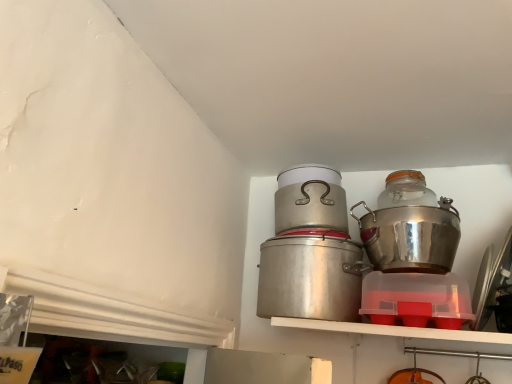
Question: From a real-world perspective, is metallic silver pot at center located higher than shiny metallic pot at right, the first crock pot in the right-to-left sequence?

Choices:
 (A) yes
 (B) no

Answer: (A)

Question: From the image's perspective, is metallic silver pot at center below shiny metallic pot at right, the 2th crock pot positioned from the left?

Choices:
 (A) yes
 (B) no

Answer: (B)

Question: Is metallic silver pot at center smaller than shiny metallic pot at right, the 2th crock pot positioned from the left?

Choices:
 (A) yes
 (B) no

Answer: (A)

Question: Is metallic silver pot at center far away from shiny metallic pot at right, the first crock pot in the right-to-left sequence?

Choices:
 (A) no
 (B) yes

Answer: (A)

Question: Is metallic silver pot at center not within shiny metallic pot at right, the first crock pot in the right-to-left sequence?

Choices:
 (A) yes
 (B) no

Answer: (A)

Question: Is metallic silver pot at center surrounding shiny metallic pot at right, the 2th crock pot positioned from the left?

Choices:
 (A) yes
 (B) no

Answer: (B)

Question: Is metallic silver pot at center a part of transparent glass jar at upper right?

Choices:
 (A) yes
 (B) no

Answer: (B)

Question: Does transparent glass jar at upper right lie in front of metallic silver pot at center?

Choices:
 (A) yes
 (B) no

Answer: (B)

Question: From a real-world perspective, is transparent glass jar at upper right positioned under metallic silver pot at center based on gravity?

Choices:
 (A) yes
 (B) no

Answer: (B)

Question: From a real-world perspective, is transparent glass jar at upper right positioned over metallic silver pot at center based on gravity?

Choices:
 (A) yes
 (B) no

Answer: (A)

Question: Can you confirm if transparent glass jar at upper right is taller than metallic silver pot at center?

Choices:
 (A) no
 (B) yes

Answer: (A)

Question: Is transparent glass jar at upper right facing away from metallic silver pot at center?

Choices:
 (A) no
 (B) yes

Answer: (A)

Question: Is shiny metallic pot at right, the 2th crock pot positioned from the left, in contact with transparent glass jar at upper right?

Choices:
 (A) yes
 (B) no

Answer: (B)